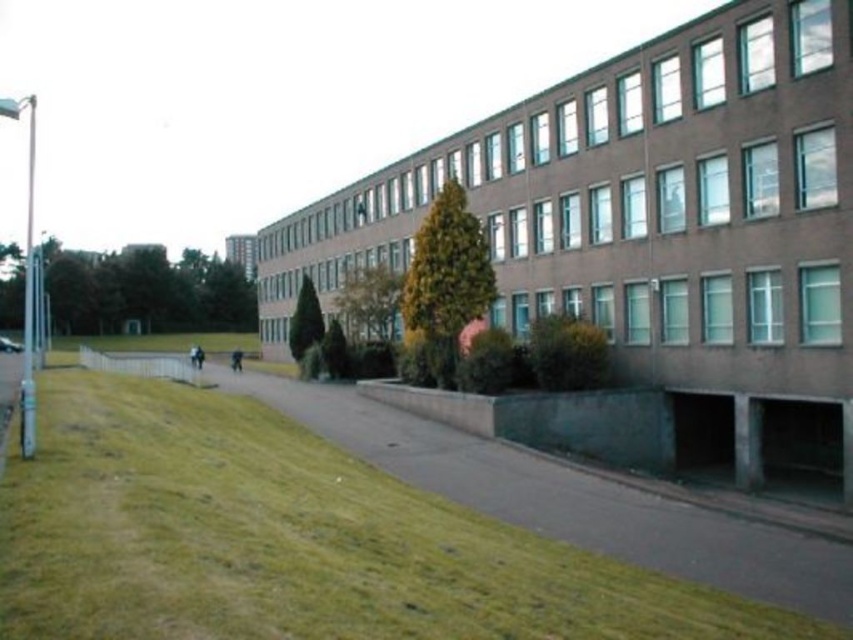
Is green grass at lower left to the right of green grass at center from the viewer's perspective?

Yes, green grass at lower left is to the right of green grass at center.

Who is positioned more to the left, green grass at lower left or green grass at center?

green grass at center

What do you see at coordinates (291, 540) in the screenshot? I see `green grass at lower left` at bounding box center [291, 540].

Identify the location of green grass at lower left. The width and height of the screenshot is (853, 640). (291, 540).